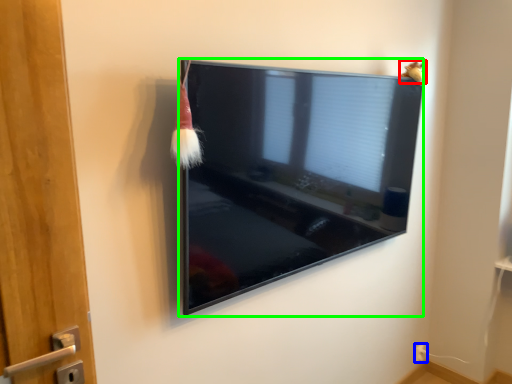
Question: Estimate the real-world distances between objects in this image. Which object is farther from animal (highlighted by a red box), electric outlet (highlighted by a blue box) or television (highlighted by a green box)?

Choices:
 (A) electric outlet
 (B) television

Answer: (A)